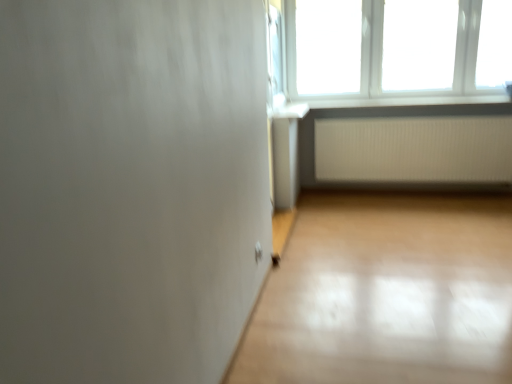
Question: From the image's perspective, is white ribbed radiator at lower right on top of white plastic window sill at upper right?

Choices:
 (A) yes
 (B) no

Answer: (B)

Question: Considering the relative positions of white ribbed radiator at lower right and white plastic window sill at upper right in the image provided, is white ribbed radiator at lower right to the left of white plastic window sill at upper right from the viewer's perspective?

Choices:
 (A) no
 (B) yes

Answer: (A)

Question: Considering the relative sizes of white ribbed radiator at lower right and white plastic window sill at upper right in the image provided, is white ribbed radiator at lower right bigger than white plastic window sill at upper right?

Choices:
 (A) yes
 (B) no

Answer: (A)

Question: Is white ribbed radiator at lower right placed right next to white plastic window sill at upper right?

Choices:
 (A) no
 (B) yes

Answer: (A)

Question: From the image's perspective, is white ribbed radiator at lower right below white plastic window sill at upper right?

Choices:
 (A) no
 (B) yes

Answer: (B)

Question: Considering the relative positions of white ribbed radiator at lower right and white plastic window sill at upper right in the image provided, is white ribbed radiator at lower right in front of white plastic window sill at upper right?

Choices:
 (A) no
 (B) yes

Answer: (A)

Question: Can you confirm if white plastic window at upper right is thinner than white ribbed radiator at lower right?

Choices:
 (A) no
 (B) yes

Answer: (A)

Question: Considering the relative sizes of white plastic window at upper right and white ribbed radiator at lower right in the image provided, is white plastic window at upper right taller than white ribbed radiator at lower right?

Choices:
 (A) no
 (B) yes

Answer: (B)

Question: Is white plastic window at upper right not inside white ribbed radiator at lower right?

Choices:
 (A) no
 (B) yes

Answer: (B)

Question: Does white plastic window at upper right have a larger size compared to white ribbed radiator at lower right?

Choices:
 (A) yes
 (B) no

Answer: (A)

Question: Considering the relative sizes of white plastic window at upper right and white ribbed radiator at lower right in the image provided, is white plastic window at upper right smaller than white ribbed radiator at lower right?

Choices:
 (A) yes
 (B) no

Answer: (B)

Question: Is white plastic window at upper right facing away from white ribbed radiator at lower right?

Choices:
 (A) yes
 (B) no

Answer: (B)

Question: Considering the relative sizes of white plastic window at upper right and white plastic window sill at upper right in the image provided, is white plastic window at upper right thinner than white plastic window sill at upper right?

Choices:
 (A) yes
 (B) no

Answer: (A)